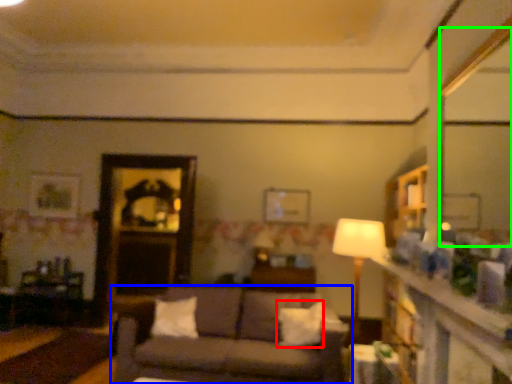
Question: Which object is the farthest from pillow (highlighted by a red box)? Choose among these: studio couch (highlighted by a blue box) or mirror (highlighted by a green box).

Choices:
 (A) studio couch
 (B) mirror

Answer: (B)